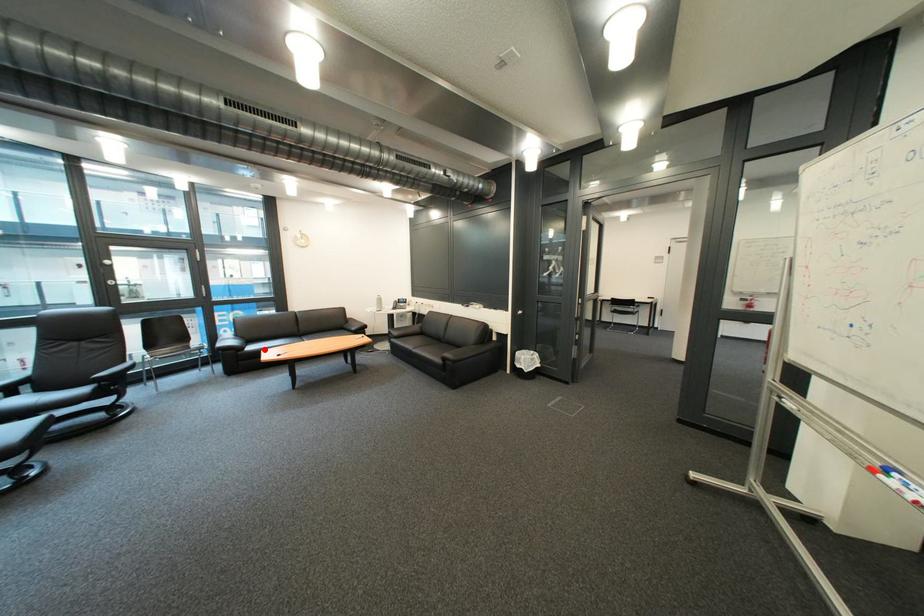
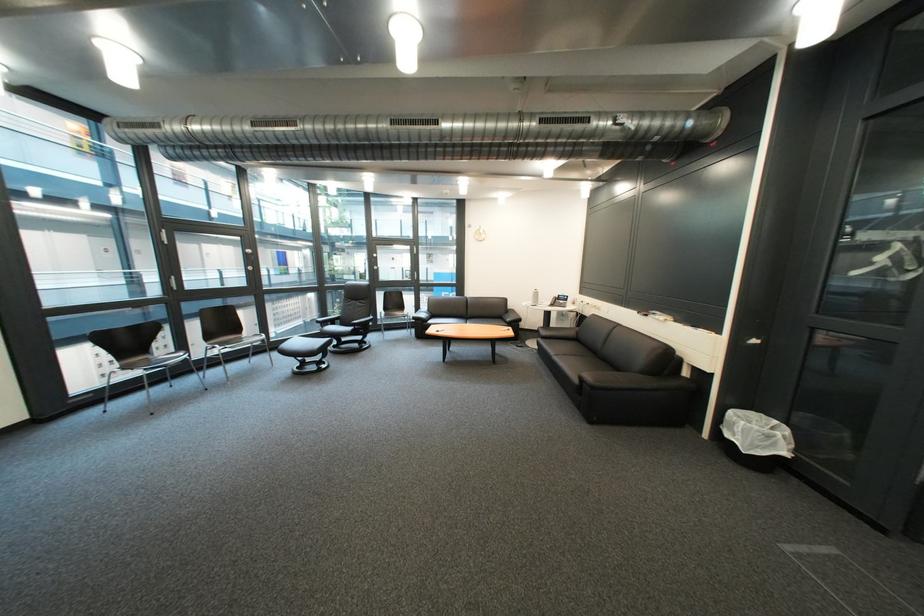
Find the pixel in the second image that matches the highlighted location in the first image.

(444, 323)